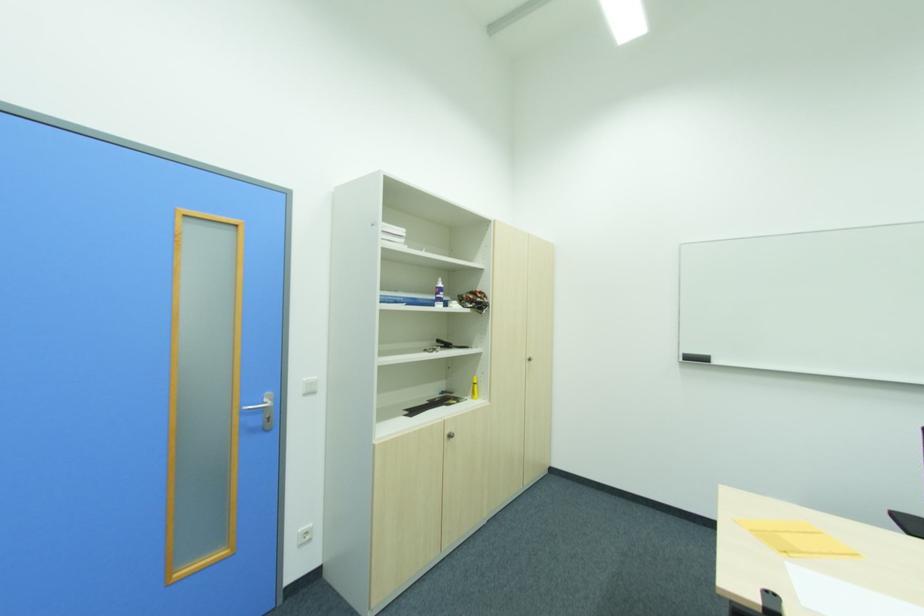
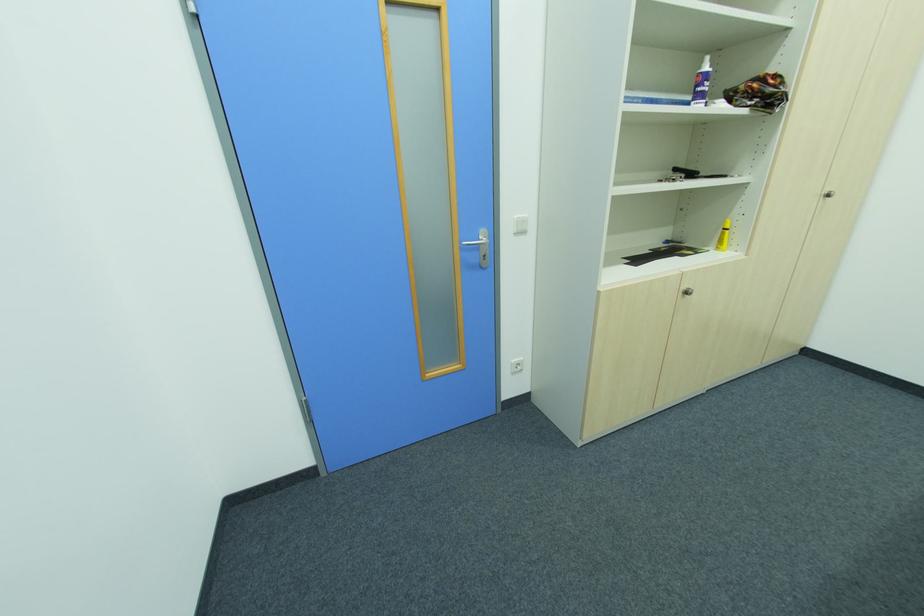
Where in the second image is the point corresponding to pixel 453 437 from the first image?

(689, 294)